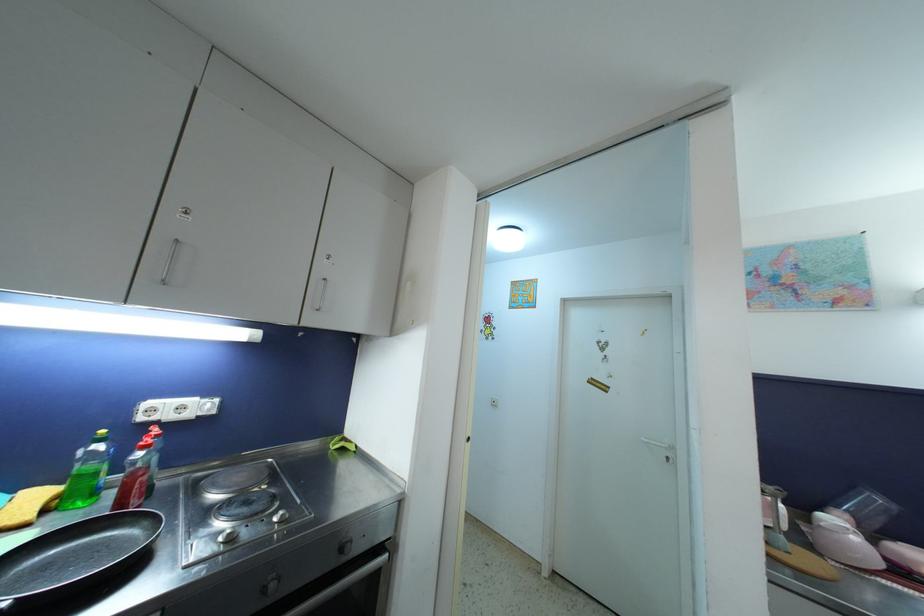
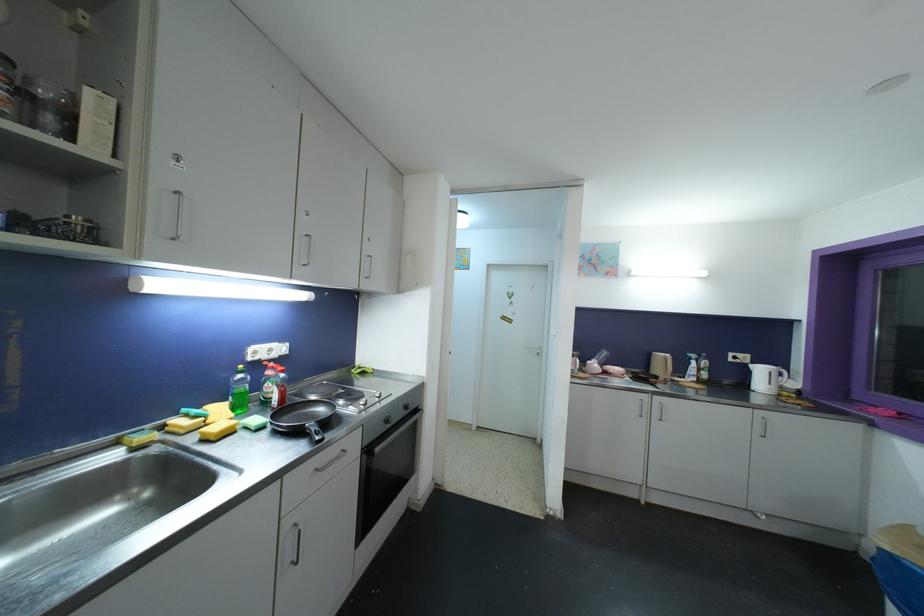
Where in the second image is the point corresponding to the point at 261,517 from the first image?

(366, 400)